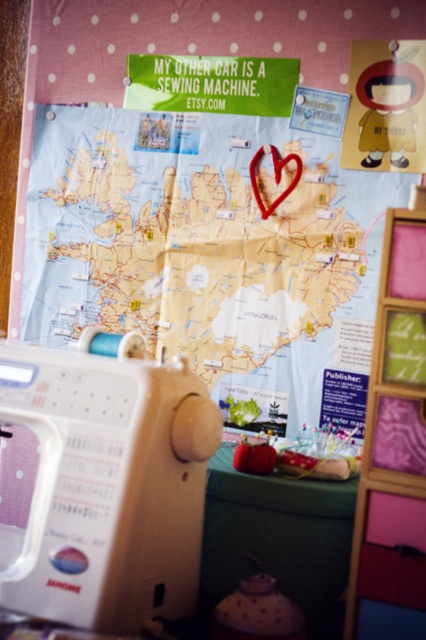
Which of these two, light blue paper map at center or green fabric table at lower center, stands taller?

light blue paper map at center is taller.

Between point (291, 272) and point (247, 545), which one is positioned behind?

Point (291, 272)

Where is `light blue paper map at center`? The height and width of the screenshot is (640, 426). light blue paper map at center is located at coordinates (184, 234).

I want to click on light blue paper map at center, so point(184,234).

Who is more forward, (28, 312) or (371, 598)?

Point (371, 598) is more forward.

Does light blue paper map at center have a greater width compared to wooden frame at center?

Correct, the width of light blue paper map at center exceeds that of wooden frame at center.

Does point (43, 120) come in front of point (380, 500)?

No.

Locate an element on the screen. Image resolution: width=426 pixels, height=640 pixels. light blue paper map at center is located at coordinates (184, 234).

Who is taller, beige plastic sewing machine at lower left or green fabric table at lower center?

beige plastic sewing machine at lower left is taller.

What do you see at coordinates (106, 481) in the screenshot? The image size is (426, 640). I see `beige plastic sewing machine at lower left` at bounding box center [106, 481].

Is point (100, 552) less distant than point (259, 515)?

Yes, it is in front of point (259, 515).

At what (x,y) coordinates should I click in order to perform the action: click on beige plastic sewing machine at lower left. Please return your answer as a coordinate pair (x, y). Looking at the image, I should click on (106, 481).